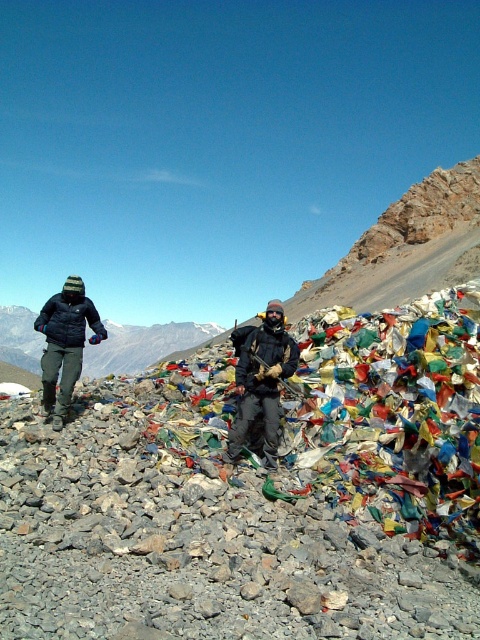
Question: Can you confirm if dark gray fabric jacket at center is positioned to the right of matte black jacket at left?

Choices:
 (A) no
 (B) yes

Answer: (B)

Question: Which point is closer to the camera taking this photo?

Choices:
 (A) (269, 410)
 (B) (97, 321)

Answer: (A)

Question: Among these points, which one is nearest to the camera?

Choices:
 (A) (86, 308)
 (B) (288, 364)

Answer: (B)

Question: Which of the following is the farthest from the observer?

Choices:
 (A) matte black jacket at left
 (B) dark gray fabric jacket at center

Answer: (A)

Question: Observing the image, what is the correct spatial positioning of dark gray fabric jacket at center in reference to matte black jacket at left?

Choices:
 (A) below
 (B) above

Answer: (A)

Question: Does dark gray fabric jacket at center have a lesser width compared to matte black jacket at left?

Choices:
 (A) yes
 (B) no

Answer: (A)